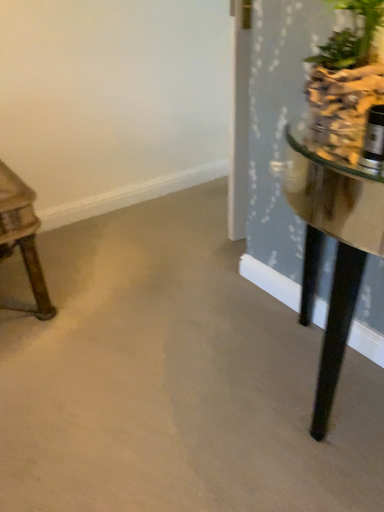
Question: From the image's perspective, is green leafy plant at upper right below smooth concrete floor at center?

Choices:
 (A) yes
 (B) no

Answer: (B)

Question: Is the position of green leafy plant at upper right more distant than that of smooth concrete floor at center?

Choices:
 (A) yes
 (B) no

Answer: (A)

Question: From a real-world perspective, is green leafy plant at upper right physically below smooth concrete floor at center?

Choices:
 (A) no
 (B) yes

Answer: (A)

Question: Does green leafy plant at upper right have a lesser height compared to smooth concrete floor at center?

Choices:
 (A) yes
 (B) no

Answer: (A)

Question: Considering the relative sizes of green leafy plant at upper right and smooth concrete floor at center in the image provided, is green leafy plant at upper right taller than smooth concrete floor at center?

Choices:
 (A) yes
 (B) no

Answer: (B)

Question: From a real-world perspective, is smooth concrete floor at center above or below green leafy plant at upper right?

Choices:
 (A) above
 (B) below

Answer: (B)

Question: From the image's perspective, relative to green leafy plant at upper right, is smooth concrete floor at center above or below?

Choices:
 (A) above
 (B) below

Answer: (B)

Question: Would you say smooth concrete floor at center is inside or outside green leafy plant at upper right?

Choices:
 (A) inside
 (B) outside

Answer: (B)

Question: Relative to green leafy plant at upper right, is smooth concrete floor at center in front or behind?

Choices:
 (A) front
 (B) behind

Answer: (A)

Question: Considering the relative positions of smooth concrete floor at center and wooden table at left in the image provided, is smooth concrete floor at center to the left or to the right of wooden table at left?

Choices:
 (A) left
 (B) right

Answer: (B)

Question: From a real-world perspective, relative to wooden table at left, is smooth concrete floor at center vertically above or below?

Choices:
 (A) below
 (B) above

Answer: (B)

Question: From their relative heights in the image, would you say smooth concrete floor at center is taller or shorter than wooden table at left?

Choices:
 (A) short
 (B) tall

Answer: (B)

Question: From the image's perspective, is smooth concrete floor at center located above or below wooden table at left?

Choices:
 (A) above
 (B) below

Answer: (B)

Question: Visually, is green leafy plant at upper right positioned to the left or to the right of smooth concrete floor at center?

Choices:
 (A) right
 (B) left

Answer: (B)

Question: Considering their positions, is green leafy plant at upper right located in front of or behind smooth concrete floor at center?

Choices:
 (A) front
 (B) behind

Answer: (B)